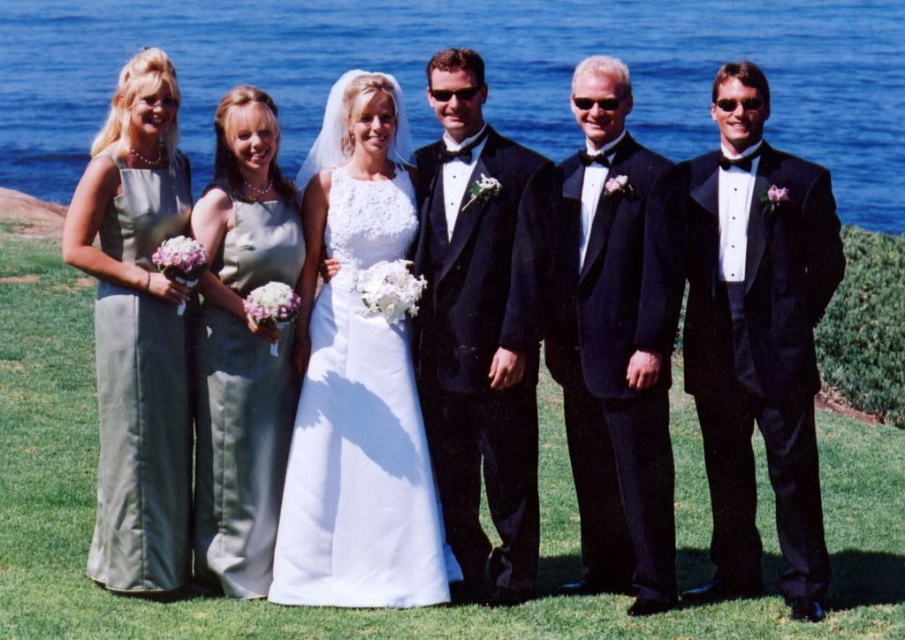
Is blue water at upper center bigger than black satin tuxedo at center?

Correct, blue water at upper center is larger in size than black satin tuxedo at center.

Between blue water at upper center and black satin tuxedo at center, which one has less height?

With less height is black satin tuxedo at center.

Identify the location of blue water at upper center. Image resolution: width=905 pixels, height=640 pixels. click(x=486, y=74).

I want to click on blue water at upper center, so click(x=486, y=74).

Is point (354, 58) positioned behind point (617, 560)?

Yes.

What are the coordinates of `blue water at upper center` in the screenshot? It's located at (486, 74).

Where is `blue water at upper center`? This screenshot has width=905, height=640. blue water at upper center is located at coordinates (486, 74).

Can you confirm if black satin tuxedo at right is bigger than satin black tuxedo at center?

Incorrect, black satin tuxedo at right is not larger than satin black tuxedo at center.

Is black satin tuxedo at right closer to camera compared to satin black tuxedo at center?

Yes.

Is point (731, 230) positioned in front of point (563, 291)?

Yes, it is in front of point (563, 291).

Where is `black satin tuxedo at right`? black satin tuxedo at right is located at coordinates (757, 339).